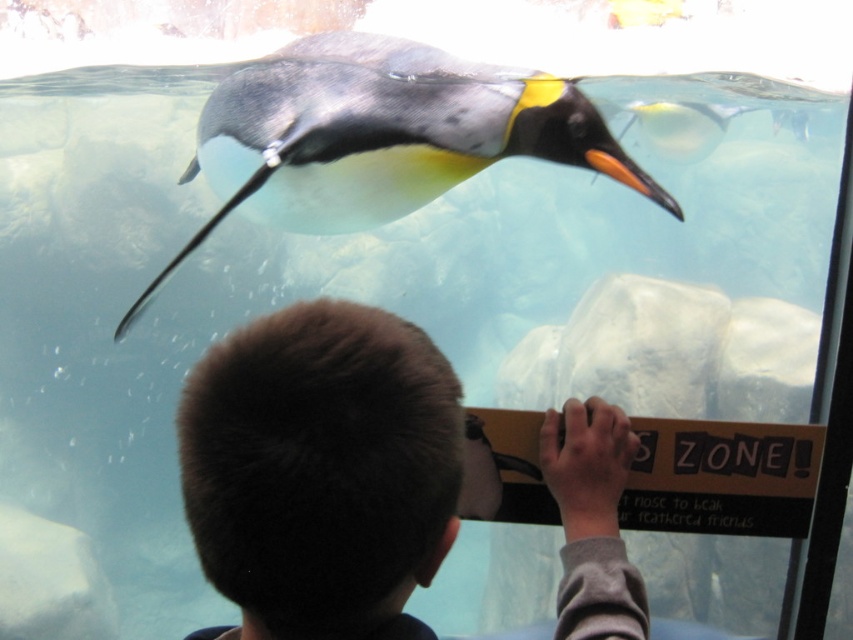
From the picture: You are a photographer trying to take a picture of the black glossy penguin at upper center without the short brown hair at lower center blocking the view. Where should you position yourself relative to the penguin?

You should position yourself to the left side of the black glossy penguin at upper center so that the short brown hair at lower center does not block the view, as the short brown hair is on the right side of the penguin.

You are a parent standing at the penguin exhibit. Your child with short brown hair at lower center is leaning against the glass to watch the penguins. If the safe distance for visitors to stand from the glass is 30 inches, is your child within the safe zone?

The short brown hair at lower center is 27.10 inches away from the viewer, which is within the safe distance of 30 inches. Therefore, the child is within the safe zone.

You are the boy in the scene. You want to see the penguin better. Which object is closer to you, the short brown hair at lower center or the black glossy penguin at upper center?

The short brown hair at lower center is closer to you than the black glossy penguin at upper center.